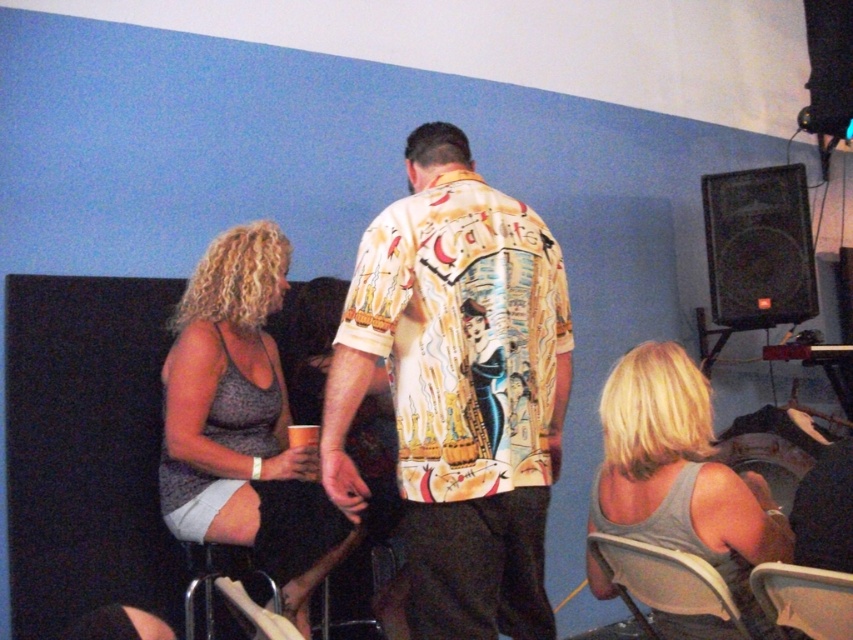
Does printed cotton shirt at center appear over black plastic speaker at right?

No.

Is point (437, 378) farther from viewer compared to point (772, 202)?

No, it is in front of (772, 202).

Which is in front, point (459, 608) or point (720, 300)?

Point (459, 608) is in front.

Where is `printed cotton shirt at center`? The height and width of the screenshot is (640, 853). printed cotton shirt at center is located at coordinates (457, 388).

Does black plastic speaker at right appear over white fabric chair at lower right?

Yes.

Is black plastic speaker at right to the left of white fabric chair at lower right from the viewer's perspective?

No, black plastic speaker at right is not to the left of white fabric chair at lower right.

Is point (724, 264) closer to camera compared to point (654, 570)?

No.

In order to click on black plastic speaker at right in this screenshot , I will do `click(759, 246)`.

Is printed cotton shirt at center smaller than clear plastic cup at center?

No, printed cotton shirt at center is not smaller than clear plastic cup at center.

Does point (374, 248) lie in front of point (300, 435)?

Yes, it is in front of point (300, 435).

I want to click on printed cotton shirt at center, so click(457, 388).